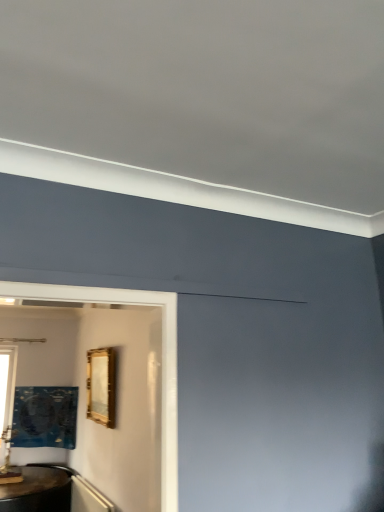
Question: From a real-world perspective, is gold metallic picture frame at center, which ranks as the 1th picture frame in top-to-bottom order, on clear glass window at left?

Choices:
 (A) no
 (B) yes

Answer: (B)

Question: Considering the relative sizes of gold metallic picture frame at center, acting as the first picture frame starting from the right, and clear glass window at left in the image provided, is gold metallic picture frame at center, acting as the first picture frame starting from the right, shorter than clear glass window at left?

Choices:
 (A) no
 (B) yes

Answer: (B)

Question: From the image's perspective, is gold metallic picture frame at center, placed as the 2th picture frame when sorted from back to front, under clear glass window at left?

Choices:
 (A) no
 (B) yes

Answer: (A)

Question: Considering the relative sizes of gold metallic picture frame at center, the second picture frame in the bottom-to-top sequence, and clear glass window at left in the image provided, is gold metallic picture frame at center, the second picture frame in the bottom-to-top sequence, smaller than clear glass window at left?

Choices:
 (A) no
 (B) yes

Answer: (A)

Question: Is gold metallic picture frame at center, acting as the first picture frame starting from the right, facing away from clear glass window at left?

Choices:
 (A) no
 (B) yes

Answer: (A)

Question: Is gold metallic picture frame at center, placed as the 2th picture frame when sorted from back to front, placed right next to clear glass window at left?

Choices:
 (A) no
 (B) yes

Answer: (A)

Question: Does metallic gold picture frame at lower left, positioned as the second picture frame in right-to-left order, have a lesser width compared to clear glass window at left?

Choices:
 (A) no
 (B) yes

Answer: (A)

Question: Is metallic gold picture frame at lower left, which appears as the 1th picture frame when viewed from the back, directly adjacent to clear glass window at left?

Choices:
 (A) no
 (B) yes

Answer: (A)

Question: Can you confirm if metallic gold picture frame at lower left, which appears as the 1th picture frame when viewed from the back, is shorter than clear glass window at left?

Choices:
 (A) no
 (B) yes

Answer: (B)

Question: Is metallic gold picture frame at lower left, positioned as the second picture frame in right-to-left order, turned away from clear glass window at left?

Choices:
 (A) no
 (B) yes

Answer: (A)

Question: From the image's perspective, is metallic gold picture frame at lower left, which appears as the 1th picture frame when viewed from the back, located beneath clear glass window at left?

Choices:
 (A) yes
 (B) no

Answer: (A)

Question: Does metallic gold picture frame at lower left, the 1th picture frame from the bottom, come in front of clear glass window at left?

Choices:
 (A) no
 (B) yes

Answer: (B)

Question: From the image's perspective, is clear glass window at left above gold metallic picture frame at center, the second picture frame in the bottom-to-top sequence?

Choices:
 (A) no
 (B) yes

Answer: (A)